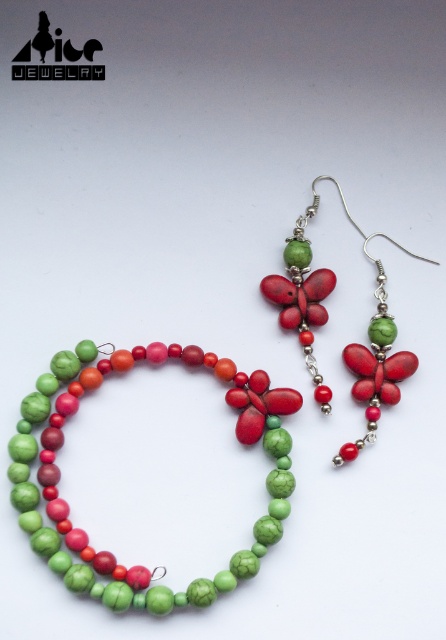
Question: Is matte ceramic beads at center below green matte beads at center?

Choices:
 (A) yes
 (B) no

Answer: (B)

Question: Is matte ceramic beads at center further to the viewer compared to green matte beads at center?

Choices:
 (A) no
 (B) yes

Answer: (B)

Question: Which object is the farthest from the matte ceramic beads at center?

Choices:
 (A) matte red butterfly at center
 (B) green matte beads at center

Answer: (A)

Question: Which point is farther to the camera?

Choices:
 (A) matte red butterfly at center
 (B) green matte beads at center

Answer: (A)

Question: Among these objects, which one is farthest from the camera?

Choices:
 (A) matte ceramic beads at center
 (B) green matte beads at center

Answer: (A)

Question: Is matte ceramic beads at center to the right of matte red butterfly at center from the viewer's perspective?

Choices:
 (A) yes
 (B) no

Answer: (B)